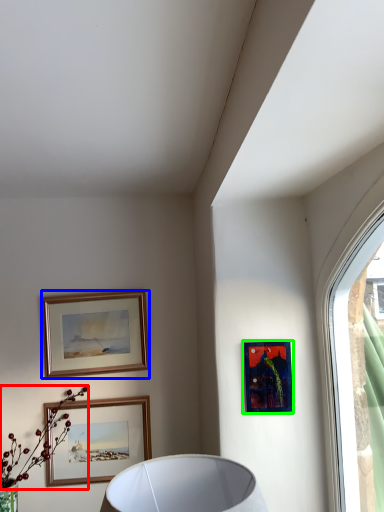
Question: Which object is positioned farthest from flower (highlighted by a red box)? Select from picture frame (highlighted by a blue box) and picture frame (highlighted by a green box).

Choices:
 (A) picture frame
 (B) picture frame

Answer: (B)